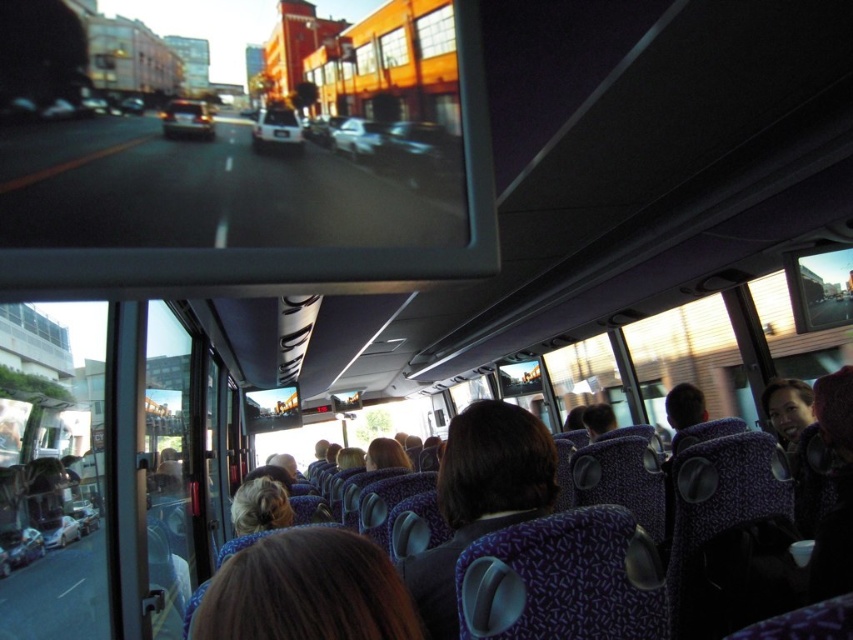
Does brown hair at center appear on the left side of blonde hair at center?

Incorrect, brown hair at center is not on the left side of blonde hair at center.

Looking at this image, can you confirm if brown hair at center is bigger than blonde hair at center?

Incorrect, brown hair at center is not larger than blonde hair at center.

The width and height of the screenshot is (853, 640). Find the location of `brown hair at center`. brown hair at center is located at coordinates (306, 589).

Can you confirm if purple fabric seat at center is thinner than blonde hair at center?

No.

Who is more distant from viewer, (x=514, y=513) or (x=271, y=481)?

The point (x=271, y=481) is behind.

Where is `purple fabric seat at center`? This screenshot has height=640, width=853. purple fabric seat at center is located at coordinates (480, 497).

Who is positioned more to the right, blonde hair at center or matte black hair at upper right?

matte black hair at upper right

Is blonde hair at center further to camera compared to matte black hair at upper right?

No, it is in front of matte black hair at upper right.

This screenshot has height=640, width=853. I want to click on blonde hair at center, so point(260,506).